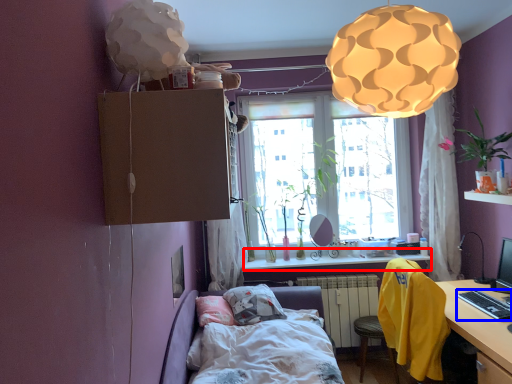
Question: Which point is further to the camera, window sill (highlighted by a red box) or desktop (highlighted by a blue box)?

Choices:
 (A) window sill
 (B) desktop

Answer: (A)